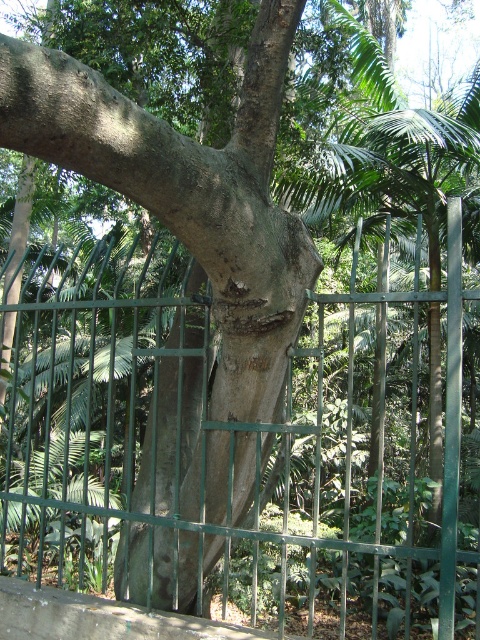
You are a gardener trying to trim the branches of the tree. You notice the green metal fence at center and the smooth gray bark at center. Which object is closer to the ground?

The green metal fence at center is closer to the ground because it is below the smooth gray bark at center.